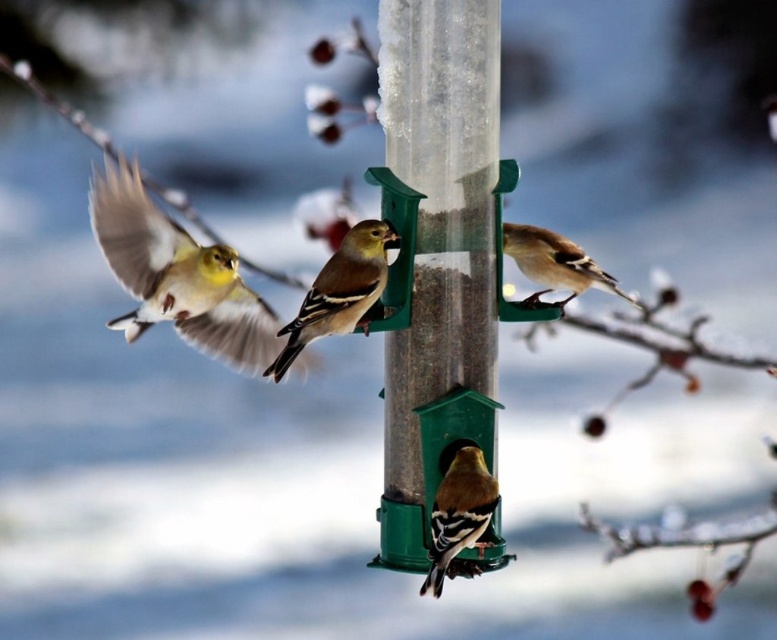
Question: Can you confirm if yellow-green feathers at center is bigger than yellow and black feathers at center?

Choices:
 (A) yes
 (B) no

Answer: (A)

Question: Which point is closer to the camera?

Choices:
 (A) (441, 580)
 (B) (378, 296)

Answer: (A)

Question: Which object is the farthest from the transparent plastic pole at center?

Choices:
 (A) golden yellow feathers at center
 (B) yellow-green feathers at center
 (C) matte yellow bird at left
 (D) yellow and black feathers at center

Answer: (C)

Question: Does matte yellow bird at left have a lesser width compared to golden yellow feathers at center?

Choices:
 (A) no
 (B) yes

Answer: (A)

Question: Which point is farther to the camera?

Choices:
 (A) (361, 291)
 (B) (387, 129)
 (C) (436, 564)
 (D) (594, 282)

Answer: (D)

Question: From the image, what is the correct spatial relationship of transparent plastic pole at center in relation to yellow-green feathers at center?

Choices:
 (A) below
 (B) above

Answer: (B)